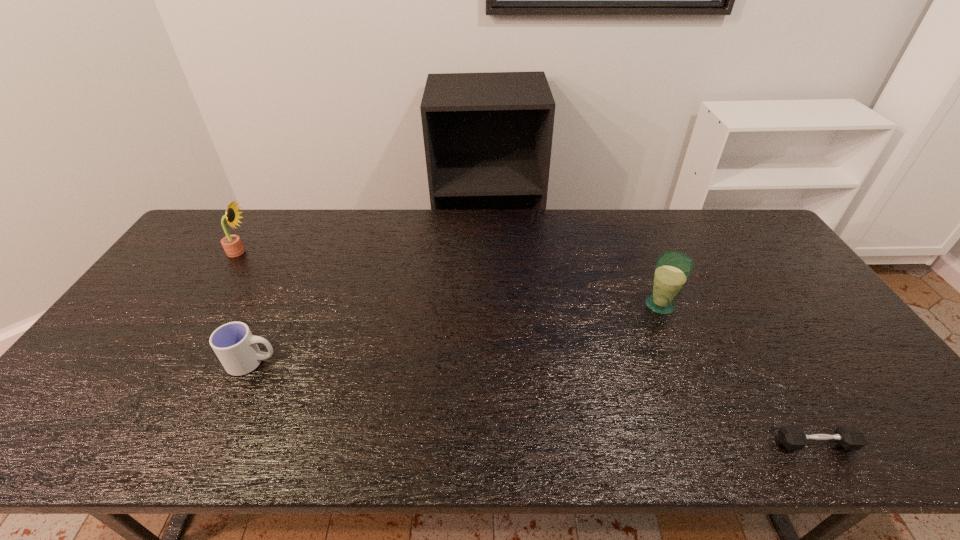
You are a GUI agent. You are given a task and a screenshot of the screen. Output one action in this format:
    pyautogui.click(x=<x>, y=<y>)
    Task: Click on the vacant space that satisfies the following two spatial constraints: 1. on the face of the second farthest object; 2. on the right side of the sunflower
    This screenshot has width=960, height=540.
    Given the screenshot: What is the action you would take?
    pyautogui.click(x=205, y=305)